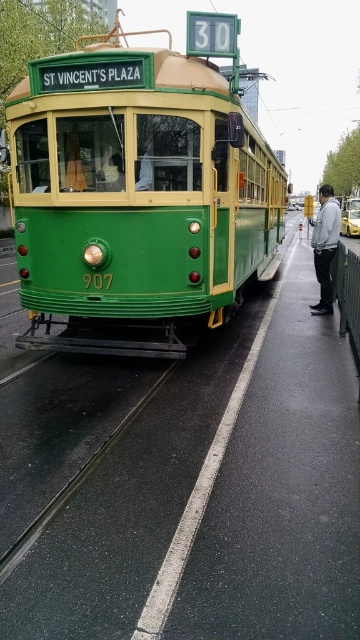
Is the position of green polished tram at center more distant than that of gray fabric jacket at center?

No, green polished tram at center is in front of gray fabric jacket at center.

Can you confirm if green polished tram at center is positioned to the right of gray fabric jacket at center?

In fact, green polished tram at center is to the left of gray fabric jacket at center.

Locate an element on the screen. Image resolution: width=360 pixels, height=640 pixels. green polished tram at center is located at coordinates (140, 193).

Which is below, gray fabric jacket at center or yellow metallic taxi at center?

Positioned lower is yellow metallic taxi at center.

How distant is gray fabric jacket at center from yellow metallic taxi at center?

The distance of gray fabric jacket at center from yellow metallic taxi at center is 8.48 meters.

Does point (326, 257) come behind point (357, 211)?

No, it is in front of (357, 211).

You are a GUI agent. You are given a task and a screenshot of the screen. Output one action in this format:
    pyautogui.click(x=<x>, y=<y>)
    Task: Click on the gray fabric jacket at center
    The width and height of the screenshot is (360, 640).
    Given the screenshot: What is the action you would take?
    tap(325, 246)

Between green polished tram at center and yellow metallic taxi at center, which one appears on the left side from the viewer's perspective?

Positioned to the left is green polished tram at center.

Can you confirm if green polished tram at center is thinner than yellow metallic taxi at center?

Incorrect, green polished tram at center's width is not less than yellow metallic taxi at center's.

Where is `green polished tram at center`? The width and height of the screenshot is (360, 640). green polished tram at center is located at coordinates (140, 193).